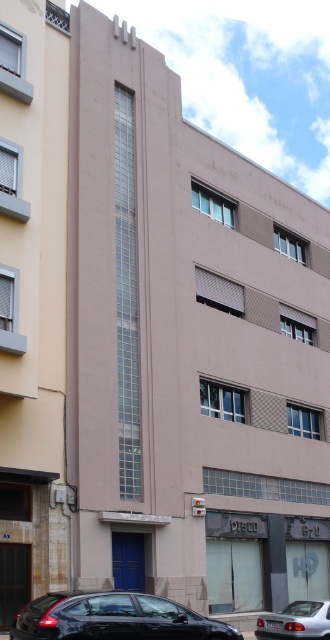
Question: Is shiny black sedan at center smaller than silver metallic car at lower center?

Choices:
 (A) yes
 (B) no

Answer: (B)

Question: Can you confirm if shiny black sedan at center is thinner than shiny black sedan at lower left?

Choices:
 (A) yes
 (B) no

Answer: (B)

Question: Estimate the real-world distances between objects in this image. Which object is farther from the shiny black sedan at lower left?

Choices:
 (A) silver metallic car at lower center
 (B) shiny black sedan at center

Answer: (A)

Question: Considering the real-world distances, which object is farthest from the shiny black sedan at lower left?

Choices:
 (A) silver metallic car at lower center
 (B) shiny black sedan at center

Answer: (A)

Question: Can you confirm if shiny black sedan at lower left is wider than silver metallic car at lower center?

Choices:
 (A) no
 (B) yes

Answer: (A)

Question: Which is nearer to the shiny black sedan at lower left?

Choices:
 (A) silver metallic car at lower center
 (B) shiny black sedan at center

Answer: (B)